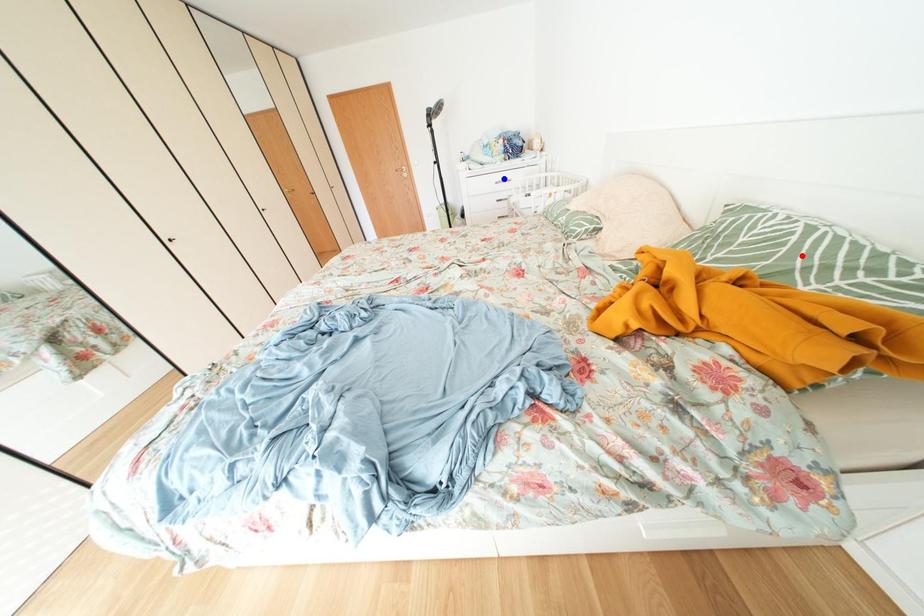
Question: In the image, two points are highlighted. Which point is nearer to the camera? Reply with the corresponding letter.

Choices:
 (A) blue point
 (B) red point

Answer: (B)